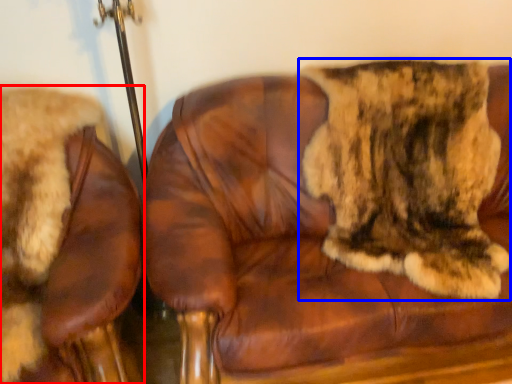
Question: Among these objects, which one is nearest to the camera, chair (highlighted by a red box) or cat (highlighted by a blue box)?

Choices:
 (A) chair
 (B) cat

Answer: (A)